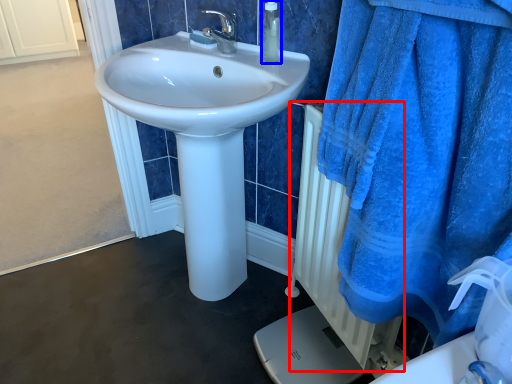
Question: Which of the following is the closest to the observer, radiator (highlighted by a red box) or soap dispenser (highlighted by a blue box)?

Choices:
 (A) radiator
 (B) soap dispenser

Answer: (A)